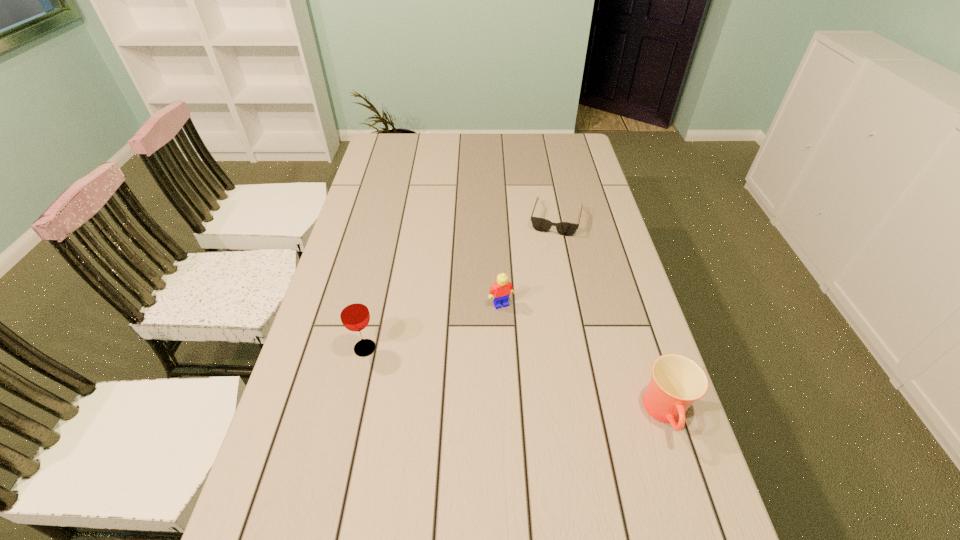
The width and height of the screenshot is (960, 540). In order to click on vacant space that is in between the nearest object and the third object from left to right in this screenshot , I will do `click(612, 316)`.

Identify the location of vacant area that lies between the rightmost object and the leftmost object. Image resolution: width=960 pixels, height=540 pixels. (516, 381).

Where is `free space between the tallest object and the rightmost object`? free space between the tallest object and the rightmost object is located at coordinates (516, 381).

Locate an element on the screen. The height and width of the screenshot is (540, 960). free spot between the third farthest object and the shortest object is located at coordinates (461, 284).

The height and width of the screenshot is (540, 960). In order to click on vacant space in between the second farthest object and the farthest object in this screenshot , I will do `click(529, 261)`.

Select which object is the closest to the cup. Please provide its 2D coordinates. Your answer should be formatted as a tuple, i.e. [(x, y)], where the tuple contains the x and y coordinates of a point satisfying the conditions above.

[(500, 292)]

Select which object appears as the closest to the shortest object. Please provide its 2D coordinates. Your answer should be formatted as a tuple, i.e. [(x, y)], where the tuple contains the x and y coordinates of a point satisfying the conditions above.

[(500, 292)]

At what (x,y) coordinates should I click in order to perform the action: click on free spot that satisfies the following two spatial constraints: 1. on the front side of the rightmost object; 2. on the left side of the Lego. Please return your answer as a coordinate pair (x, y). Looking at the image, I should click on (506, 414).

The height and width of the screenshot is (540, 960). In order to click on vacant space that satisfies the following two spatial constraints: 1. on the back side of the farthest object; 2. on the right side of the second farthest object in this screenshot , I will do `click(497, 219)`.

The image size is (960, 540). I want to click on vacant region that satisfies the following two spatial constraints: 1. on the back side of the sunglasses; 2. on the left side of the glass, so click(394, 219).